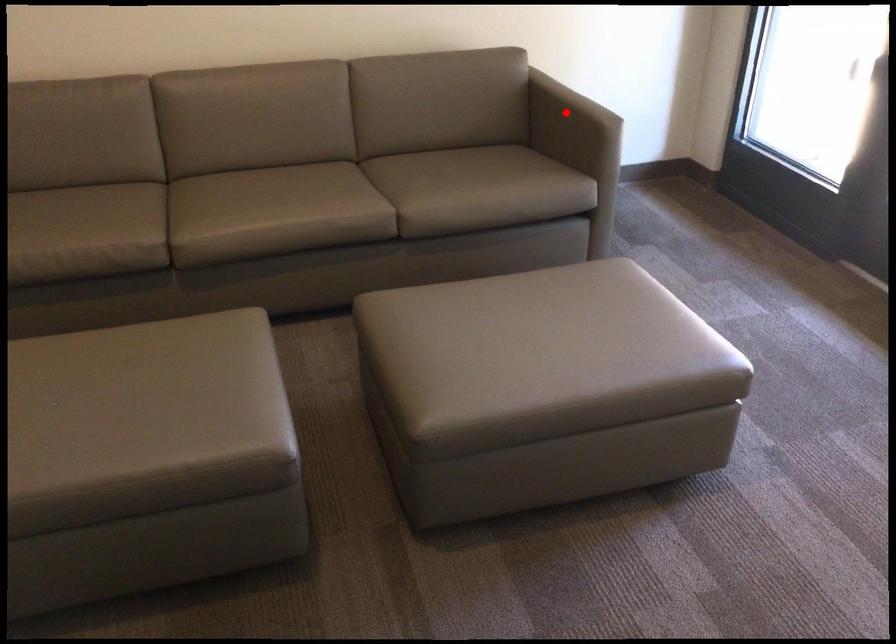
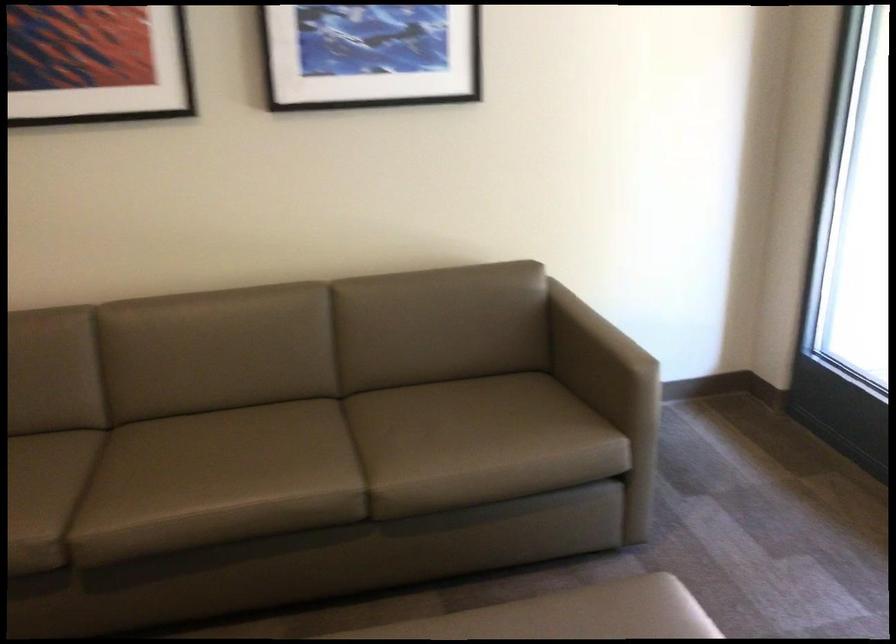
Find the pixel in the second image that matches the highlighted location in the first image.

(597, 355)